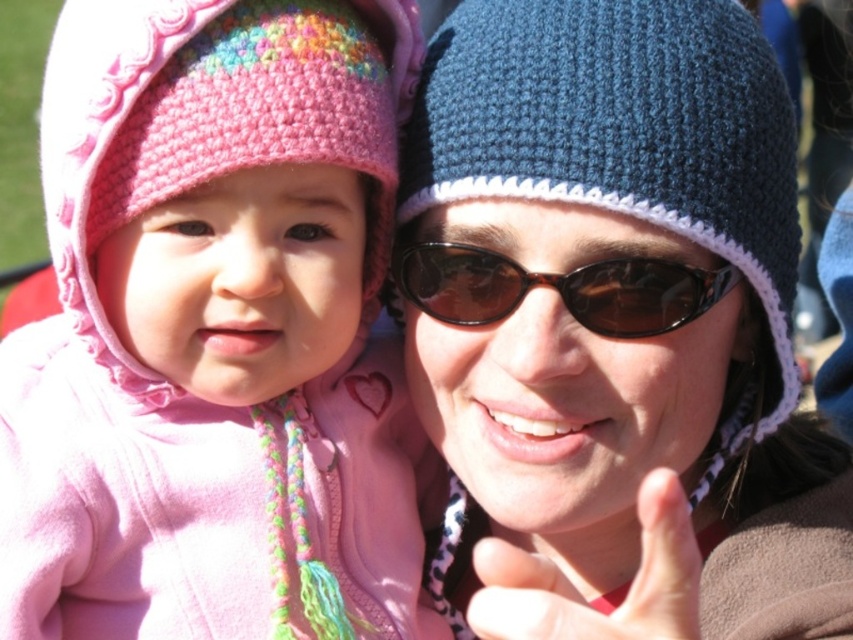
Question: Does matte pink knit hat at left have a larger size compared to knitted blue hat at center?

Choices:
 (A) no
 (B) yes

Answer: (A)

Question: Is matte pink knit hat at left positioned before tortoiseshell sunglasses at center?

Choices:
 (A) yes
 (B) no

Answer: (A)

Question: Which object is positioned farthest from the matte pink knit hat at left?

Choices:
 (A) tortoiseshell sunglasses at center
 (B) knitted blue hat at center

Answer: (A)

Question: Does knitted blue hat at center lie in front of tortoiseshell sunglasses at center?

Choices:
 (A) no
 (B) yes

Answer: (B)

Question: Which point is farther from the camera taking this photo?

Choices:
 (A) (686, 264)
 (B) (426, 294)

Answer: (B)

Question: Among these points, which one is farthest from the camera?

Choices:
 (A) (682, 300)
 (B) (779, 426)
 (C) (199, 109)

Answer: (B)